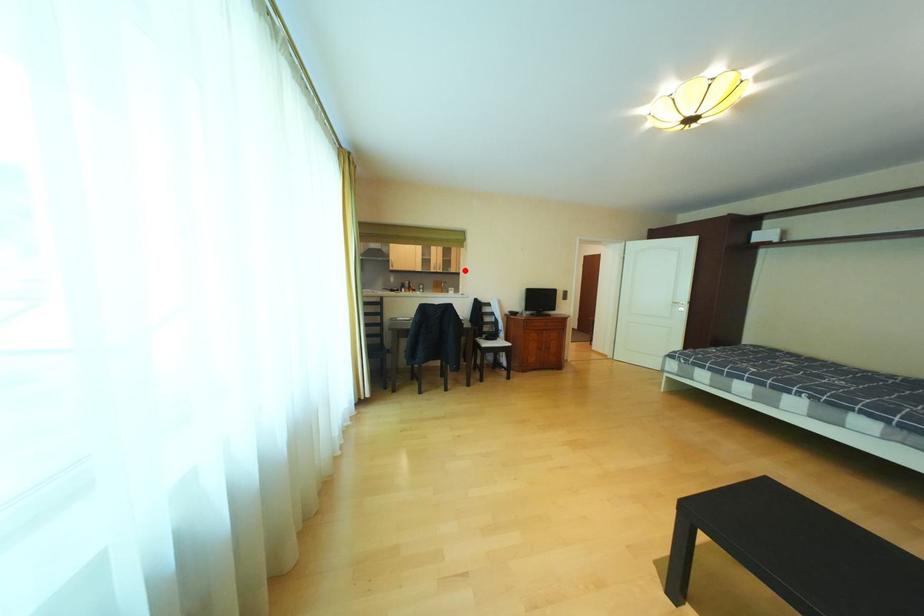
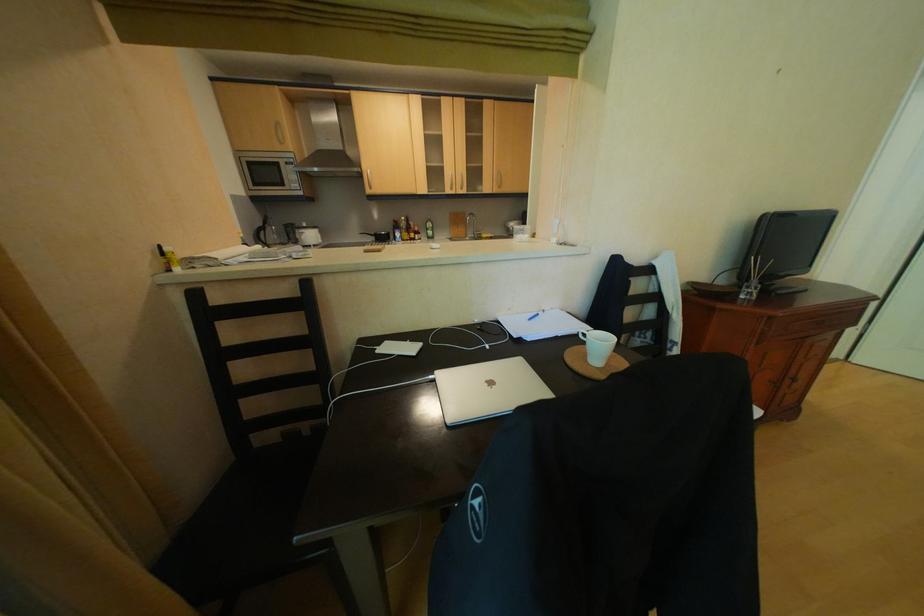
Find the pixel in the second image that matches the highlighted location in the first image.

(499, 188)